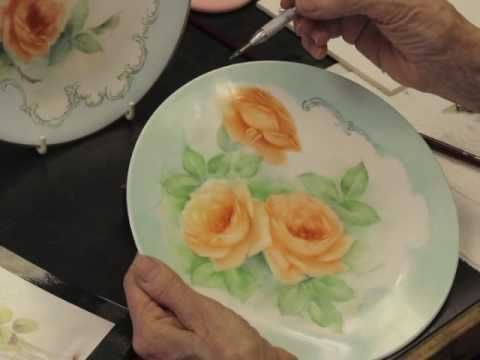
At what (x,y) coordinates should I click in order to perform the action: click on stencil embellishment. Please return your answer as a coordinate pair (x, y). The height and width of the screenshot is (360, 480). Looking at the image, I should click on (19, 87), (71, 99), (127, 83), (152, 16), (318, 101), (355, 128).